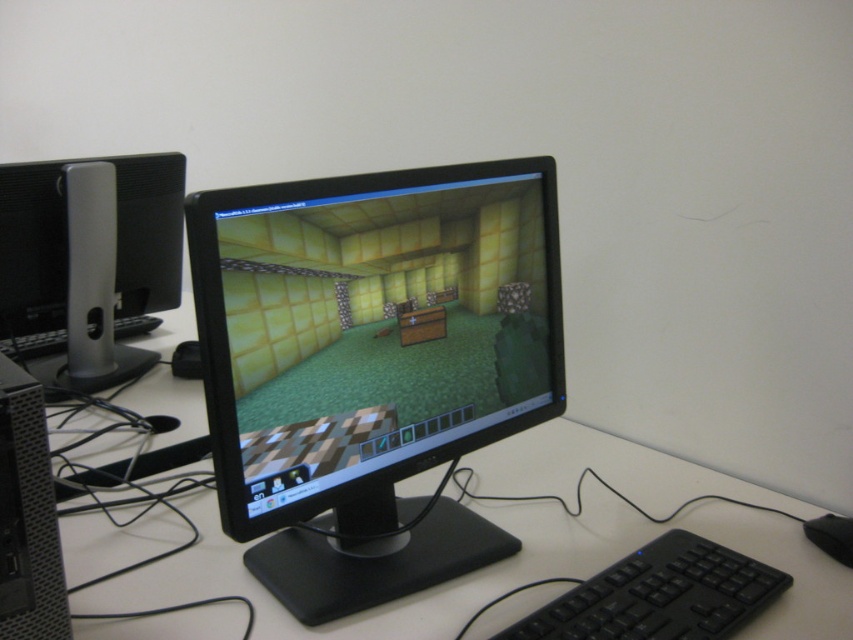
Who is positioned more to the left, white plastic computer desk at center or black textured computer tower at lower left?

Positioned to the left is black textured computer tower at lower left.

In order to click on white plastic computer desk at center in this screenshot , I will do `click(502, 570)`.

Identify the location of white plastic computer desk at center. (502, 570).

Where is `white plastic computer desk at center`? This screenshot has height=640, width=853. white plastic computer desk at center is located at coordinates (502, 570).

Does white plastic computer desk at center appear over silver/black plastic monitor at left?

No.

Where is `white plastic computer desk at center`? Image resolution: width=853 pixels, height=640 pixels. white plastic computer desk at center is located at coordinates (502, 570).

Where is `white plastic computer desk at center`? The width and height of the screenshot is (853, 640). white plastic computer desk at center is located at coordinates (502, 570).

Does black glossy monitor at center come in front of black plastic mouse at lower right?

Yes, black glossy monitor at center is in front of black plastic mouse at lower right.

Locate an element on the screen. Image resolution: width=853 pixels, height=640 pixels. black glossy monitor at center is located at coordinates (370, 365).